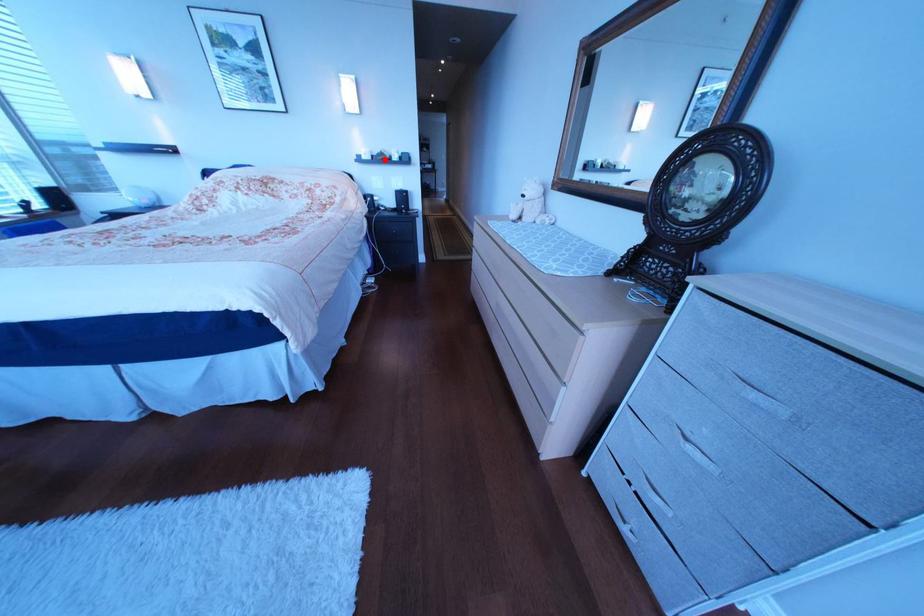
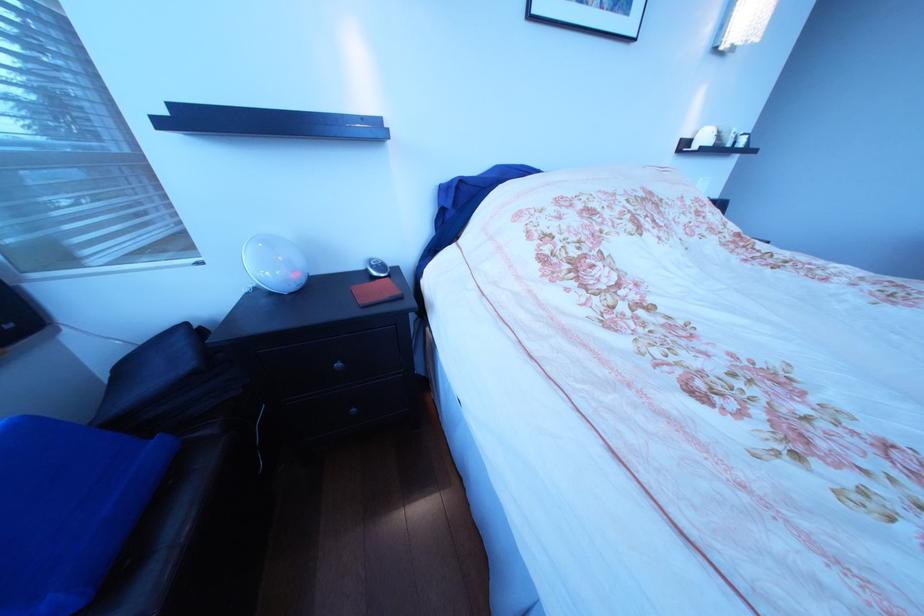
Question: I am providing you with two images of the same scene from different viewpoints. In image1, a red point is highlighted. Considering the same 3D point in image2, which of the following is correct?

Choices:
 (A) It is closer
 (B) It is farther

Answer: (B)